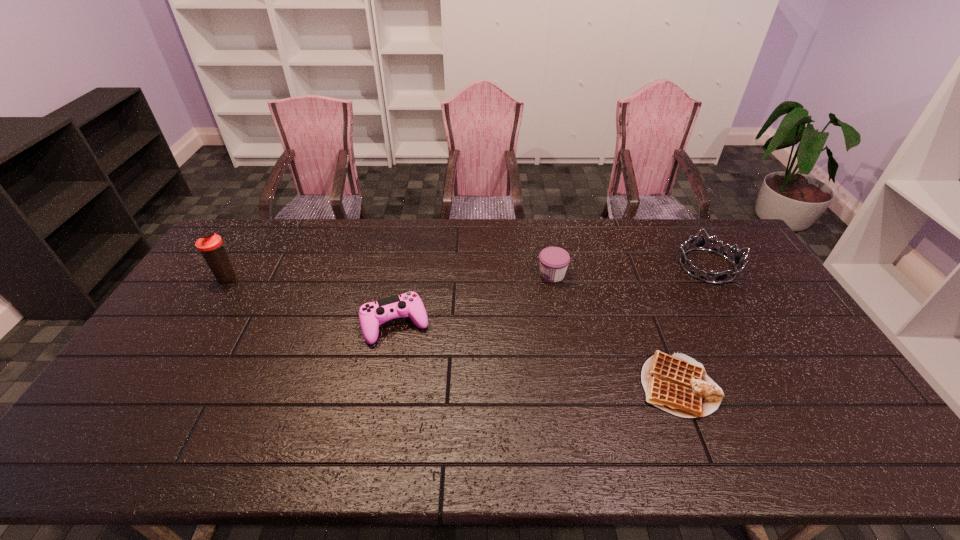
At what (x,y) coordinates should I click in order to perform the action: click on the leftmost object. Please return your answer as a coordinate pair (x, y). Looking at the image, I should click on point(210,245).

Locate an element on the screen. the tallest object is located at coordinates (210, 245).

Locate an element on the screen. Image resolution: width=960 pixels, height=540 pixels. the third object from left to right is located at coordinates (554, 261).

This screenshot has width=960, height=540. In order to click on the rightmost object in this screenshot , I will do `click(700, 244)`.

Locate an element on the screen. Image resolution: width=960 pixels, height=540 pixels. the second nearest object is located at coordinates (371, 314).

The height and width of the screenshot is (540, 960). What are the coordinates of `the fourth object from right to left` in the screenshot? It's located at (371, 314).

Locate an element on the screen. the fourth object from left to right is located at coordinates [x=678, y=384].

Find the location of `waffle`. waffle is located at coordinates (678, 384).

The width and height of the screenshot is (960, 540). Identify the location of vacant space located 0.160m on the back of the tallest object. (251, 241).

Locate an element on the screen. This screenshot has height=540, width=960. vacant space located 0.160m on the front label of the jam is located at coordinates (490, 275).